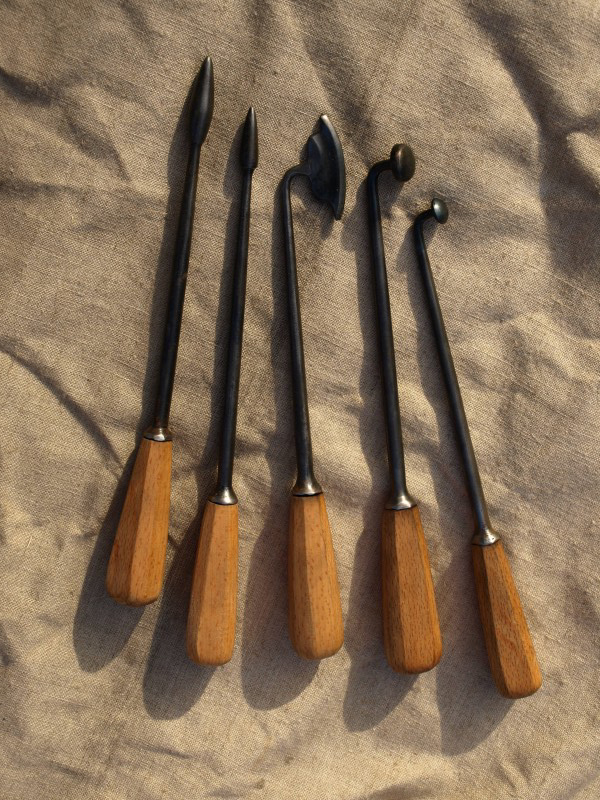
This screenshot has width=600, height=800. I want to click on linen sheet, so click(495, 134).